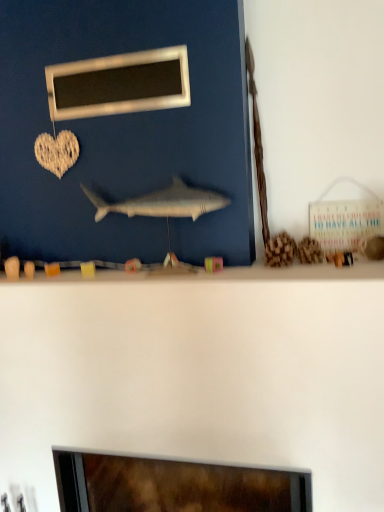
Question: Considering the positions of metallic rectangular frame at upper center and gray matte shark at center in the image, is metallic rectangular frame at upper center taller or shorter than gray matte shark at center?

Choices:
 (A) tall
 (B) short

Answer: (A)

Question: Is metallic rectangular frame at upper center situated inside gray matte shark at center or outside?

Choices:
 (A) inside
 (B) outside

Answer: (B)

Question: Considering the relative positions of metallic rectangular frame at upper center and gray matte shark at center in the image provided, is metallic rectangular frame at upper center to the left or to the right of gray matte shark at center?

Choices:
 (A) left
 (B) right

Answer: (A)

Question: In the image, is gray matte shark at center on the left side or the right side of metallic rectangular frame at upper center?

Choices:
 (A) left
 (B) right

Answer: (B)

Question: Is point (205, 193) positioned closer to the camera than point (77, 86)?

Choices:
 (A) closer
 (B) farther

Answer: (A)

Question: In terms of size, does gray matte shark at center appear bigger or smaller than metallic rectangular frame at upper center?

Choices:
 (A) small
 (B) big

Answer: (B)

Question: Considering the positions of gray matte shark at center and metallic rectangular frame at upper center in the image, is gray matte shark at center wider or thinner than metallic rectangular frame at upper center?

Choices:
 (A) wide
 (B) thin

Answer: (A)